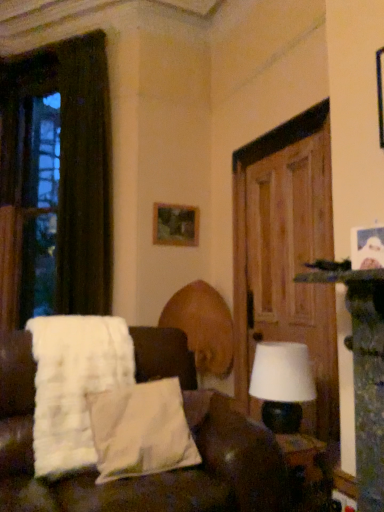
Question: Is wooden door at right located within dark brown fabric curtain at left?

Choices:
 (A) no
 (B) yes

Answer: (A)

Question: Is dark brown fabric curtain at left oriented away from wooden door at right?

Choices:
 (A) yes
 (B) no

Answer: (B)

Question: Does dark brown fabric curtain at left have a larger size compared to wooden door at right?

Choices:
 (A) no
 (B) yes

Answer: (B)

Question: Are dark brown fabric curtain at left and wooden door at right beside each other?

Choices:
 (A) no
 (B) yes

Answer: (A)

Question: Is dark brown fabric curtain at left wider than wooden door at right?

Choices:
 (A) yes
 (B) no

Answer: (A)

Question: In the image, is white fluffy blanket at left on the left side or the right side of white soft pillow at lower left?

Choices:
 (A) right
 (B) left

Answer: (B)

Question: Is point (39, 431) positioned closer to the camera than point (112, 452)?

Choices:
 (A) farther
 (B) closer

Answer: (A)

Question: In the image, is white fluffy blanket at left positioned in front of or behind white soft pillow at lower left?

Choices:
 (A) front
 (B) behind

Answer: (B)

Question: From a real-world perspective, is white fluffy blanket at left above or below white soft pillow at lower left?

Choices:
 (A) below
 (B) above

Answer: (B)

Question: From a real-world perspective, is transparent glass window at left physically located above or below white fabric couch at center?

Choices:
 (A) above
 (B) below

Answer: (A)

Question: Considering the positions of point (52, 260) and point (31, 503), is point (52, 260) closer or farther from the camera than point (31, 503)?

Choices:
 (A) farther
 (B) closer

Answer: (A)

Question: From the image's perspective, is transparent glass window at left located above or below white fabric couch at center?

Choices:
 (A) below
 (B) above

Answer: (B)

Question: Considering the positions of transparent glass window at left and white fabric couch at center in the image, is transparent glass window at left wider or thinner than white fabric couch at center?

Choices:
 (A) thin
 (B) wide

Answer: (A)

Question: From their relative heights in the image, would you say wooden picture frame at upper center is taller or shorter than white soft pillow at lower left?

Choices:
 (A) tall
 (B) short

Answer: (A)

Question: Considering the relative positions of wooden picture frame at upper center and white soft pillow at lower left in the image provided, is wooden picture frame at upper center to the left or to the right of white soft pillow at lower left?

Choices:
 (A) left
 (B) right

Answer: (B)